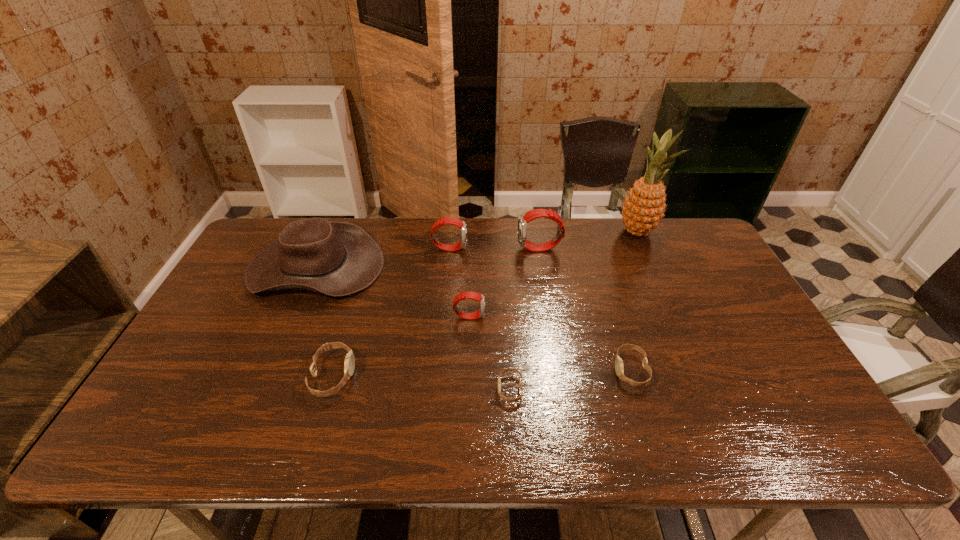
Where is `free space located on the face of the fourth tallest object`? The height and width of the screenshot is (540, 960). free space located on the face of the fourth tallest object is located at coordinates (543, 248).

Identify the location of vacant space positioned on the face of the fifth tallest object. The image size is (960, 540). (564, 316).

Where is `free spot located 0.290m on the face of the leftmost watch`? The height and width of the screenshot is (540, 960). free spot located 0.290m on the face of the leftmost watch is located at coordinates (468, 375).

I want to click on vacant space located 0.230m on the face of the seventh object from left to right, so click(525, 370).

Find the location of a particular element. The width and height of the screenshot is (960, 540). blank space located 0.170m on the face of the seventh object from left to right is located at coordinates (548, 370).

Locate an element on the screen. This screenshot has width=960, height=540. vacant space located on the face of the seventh object from left to right is located at coordinates coord(560,370).

I want to click on vacant space situated on the face of the shortest watch, so click(449, 389).

You are a GUI agent. You are given a task and a screenshot of the screen. Output one action in this format:
    pyautogui.click(x=<x>, y=<y>)
    Task: Click on the vacant point located 0.210m on the face of the shortest watch
    This screenshot has width=960, height=540.
    Given the screenshot: What is the action you would take?
    pos(413,389)

Where is `vacant area situated 0.310m on the face of the shortest watch`? This screenshot has width=960, height=540. vacant area situated 0.310m on the face of the shortest watch is located at coordinates (372, 389).

Where is `pineapple at the far edge`? Image resolution: width=960 pixels, height=540 pixels. pineapple at the far edge is located at coordinates (643, 209).